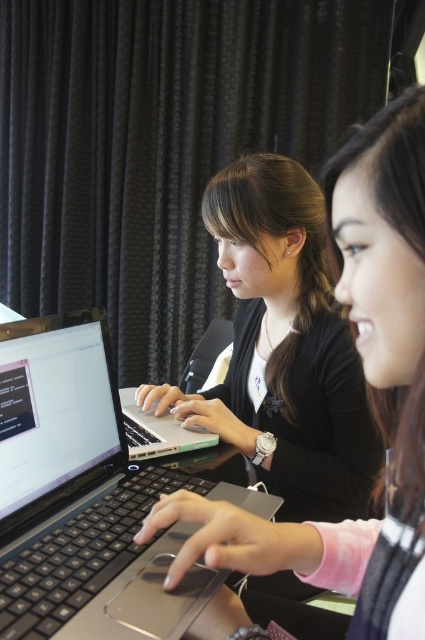
Question: Is silver metallic laptop at center below matte black laptop at left?

Choices:
 (A) no
 (B) yes

Answer: (B)

Question: Is the position of matte black laptop at left less distant than that of silver metallic laptop at left?

Choices:
 (A) no
 (B) yes

Answer: (B)

Question: Which of these objects is positioned farthest from the silver metallic laptop at left?

Choices:
 (A) matte black laptop at left
 (B) silver metallic laptop at center

Answer: (A)

Question: Which object appears closest to the camera in this image?

Choices:
 (A) silver metallic laptop at center
 (B) matte black laptop at left

Answer: (B)

Question: Which point is farther to the camera?

Choices:
 (A) matte black laptop at left
 (B) silver metallic laptop at left
 (C) silver metallic laptop at center

Answer: (B)

Question: Does silver metallic laptop at center appear on the right side of matte black laptop at left?

Choices:
 (A) yes
 (B) no

Answer: (B)